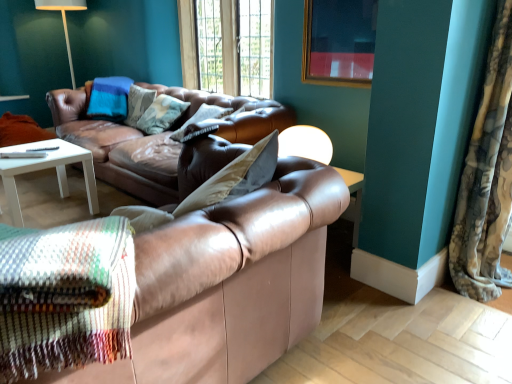
Question: From a real-world perspective, relative to matte white table lamp at center, is fluffy fabric curtain at right vertically above or below?

Choices:
 (A) below
 (B) above

Answer: (B)

Question: From the image's perspective, is fluffy fabric curtain at right positioned above or below matte white table lamp at center?

Choices:
 (A) below
 (B) above

Answer: (A)

Question: Estimate the real-world distances between objects in this image. Which object is farther from the matte white table lamp at center?

Choices:
 (A) wooden frame at upper center
 (B) gold-framed picture at upper center
 (C) leather pillow at center
 (D) fluffy fabric curtain at right
 (E) leather couch at center, which is the 1th studio couch from back to front

Answer: (A)

Question: Considering the real-world distances, which object is farthest from the leather couch at center, acting as the second studio couch starting from the front?

Choices:
 (A) leather couch at center, which ranks as the 2th studio couch in back-to-front order
 (B) gold-framed picture at upper center
 (C) fluffy fabric curtain at right
 (D) leather pillow at center
 (E) wooden frame at upper center

Answer: (C)